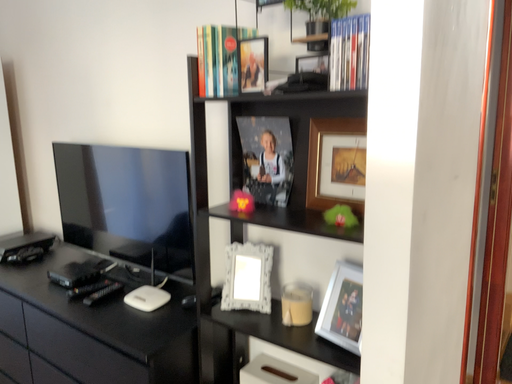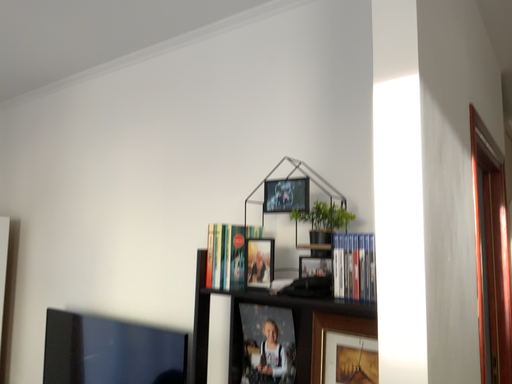
Question: How did the camera likely rotate when shooting the video?

Choices:
 (A) rotated downward
 (B) rotated upward

Answer: (B)